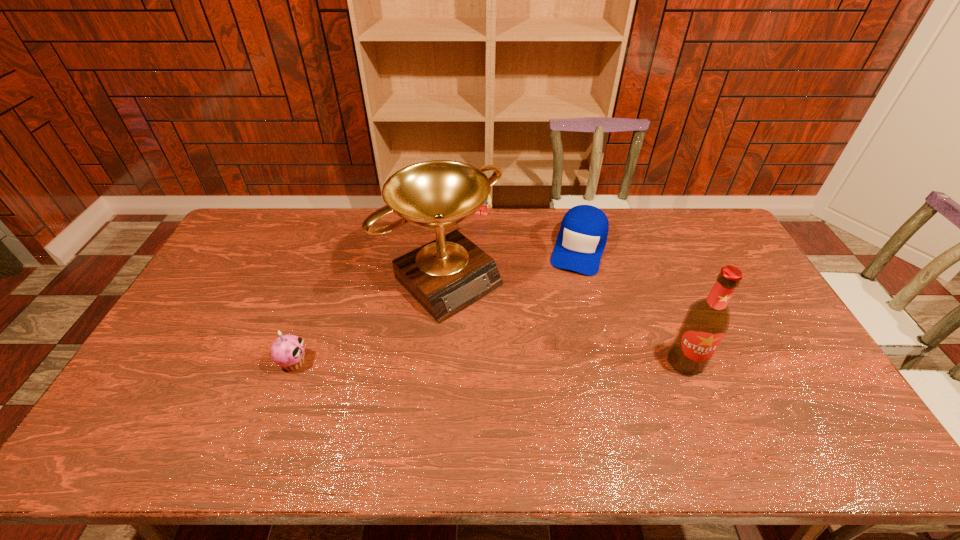
At what (x,y) coordinates should I click in order to perform the action: click on vacant spot on the desktop that is between the cupcake and the beer bottle and is positioned on the front-facing side of the award. Please return your answer as a coordinate pair (x, y). The image size is (960, 540). Looking at the image, I should click on (532, 362).

At what (x,y) coordinates should I click in order to perform the action: click on vacant space on the desktop that is between the leftmost object and the rightmost object and is positioned on the front-facing side of the fourth object from left to right. Please return your answer as a coordinate pair (x, y). Looking at the image, I should click on (540, 362).

This screenshot has width=960, height=540. In order to click on vacant space on the desktop that is between the leftmost object and the beer bottle and is positioned on the front-facing side of the Lego in this screenshot , I will do pos(431,362).